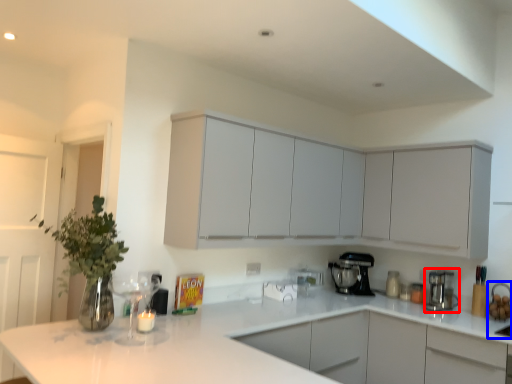
Question: Which of the following is the closest to the observer, kitchen appliance (highlighted by a red box) or sink (highlighted by a blue box)?

Choices:
 (A) kitchen appliance
 (B) sink

Answer: (B)